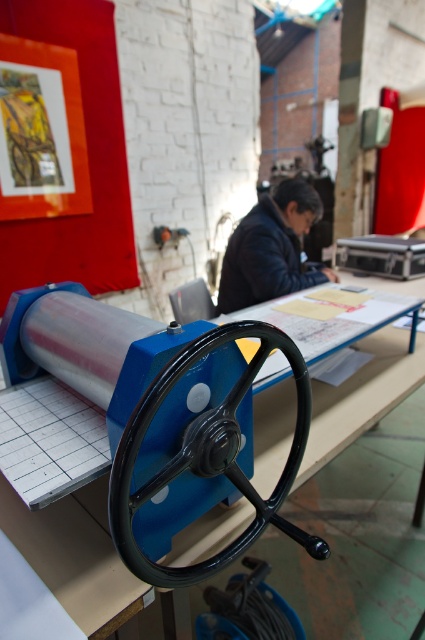
Is point (192, 445) closer to viewer compared to point (266, 205)?

Yes, point (192, 445) is in front of point (266, 205).

What are the coordinates of `black polished wheel at center` in the screenshot? It's located at (195, 444).

Between blue plastic table at center and dark blue leather jacket at upper center, which one is positioned lower?

blue plastic table at center

Does point (113, 611) lie behind point (334, 273)?

No, it is not.

I want to click on blue plastic table at center, so click(74, 556).

Between black polished wheel at center and blue plastic table at center, which one has less height?

Standing shorter between the two is black polished wheel at center.

Which is in front, point (246, 460) or point (388, 360)?

Point (246, 460) is more forward.

This screenshot has width=425, height=640. I want to click on black polished wheel at center, so click(x=195, y=444).